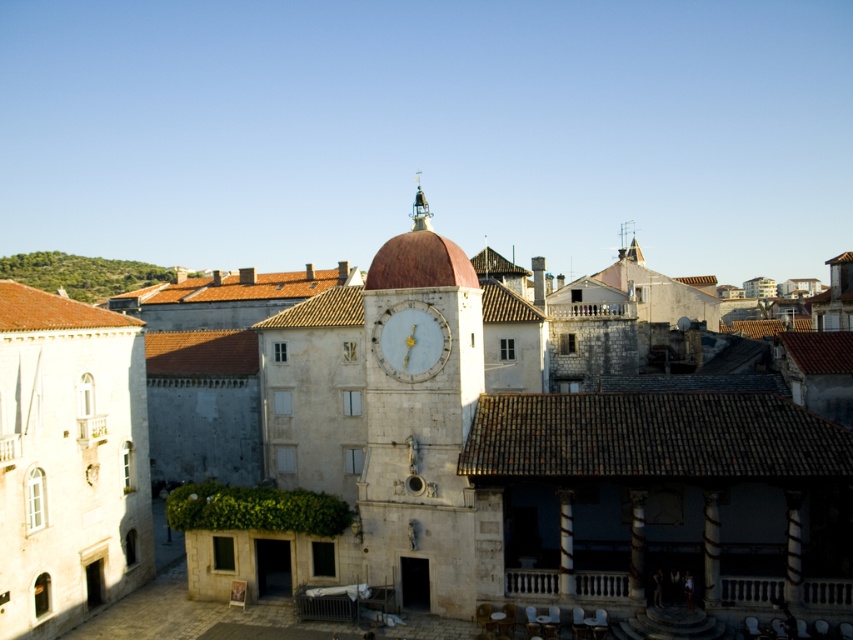
Looking at this image, which of these two, white stone clock tower at center or smooth stone clock tower at center, stands shorter?

smooth stone clock tower at center is shorter.

Does white stone clock tower at center have a greater width compared to smooth stone clock tower at center?

Correct, the width of white stone clock tower at center exceeds that of smooth stone clock tower at center.

What do you see at coordinates (503, 467) in the screenshot? This screenshot has width=853, height=640. I see `white stone clock tower at center` at bounding box center [503, 467].

Image resolution: width=853 pixels, height=640 pixels. What are the coordinates of `white stone clock tower at center` in the screenshot? It's located at (503, 467).

Which is more to the left, smooth stone clock tower at center or light blue marble clock at center?

From the viewer's perspective, smooth stone clock tower at center appears more on the left side.

Which is below, smooth stone clock tower at center or light blue marble clock at center?

Positioned lower is smooth stone clock tower at center.

Which is in front, point (413, 276) or point (398, 316)?

Positioned in front is point (413, 276).

Locate an element on the screen. smooth stone clock tower at center is located at coordinates (421, 417).

Does white stone clock tower at center come behind light blue marble clock at center?

No, it is in front of light blue marble clock at center.

Is point (392, 282) positioned in front of point (430, 336)?

No, it is not.

What do you see at coordinates (503, 467) in the screenshot?
I see `white stone clock tower at center` at bounding box center [503, 467].

The width and height of the screenshot is (853, 640). Identify the location of white stone clock tower at center. (503, 467).